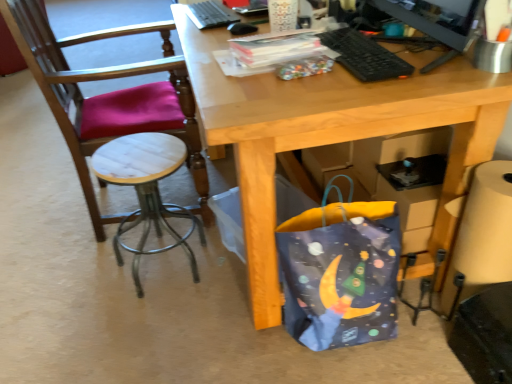
Question: From the image's perspective, is black plastic keyboard at upper center, which is the second laptop keyboard from back to front, located above or below blue fabric bag at lower right?

Choices:
 (A) above
 (B) below

Answer: (A)

Question: From their relative heights in the image, would you say black plastic keyboard at upper center, which is counted as the 1th laptop keyboard, starting from the front, is taller or shorter than blue fabric bag at lower right?

Choices:
 (A) tall
 (B) short

Answer: (B)

Question: Based on their relative distances, which object is nearer to the black matte mouse at upper center?

Choices:
 (A) white marble stool at left
 (B) black plastic keyboard at upper center, the 1th laptop keyboard from the right
 (C) blue fabric bag at lower right
 (D) black glossy monitor at upper right
 (E) wooden/marble stool at left

Answer: (B)

Question: Which object is positioned closest to the black plastic keyboard at upper center, which is counted as the first laptop keyboard, starting from the left?

Choices:
 (A) black glossy monitor at upper right
 (B) white marble stool at left
 (C) black plastic keyboard at upper center, which is the 2th laptop keyboard from left to right
 (D) wooden/marble stool at left
 (E) blue fabric bag at lower right

Answer: (D)